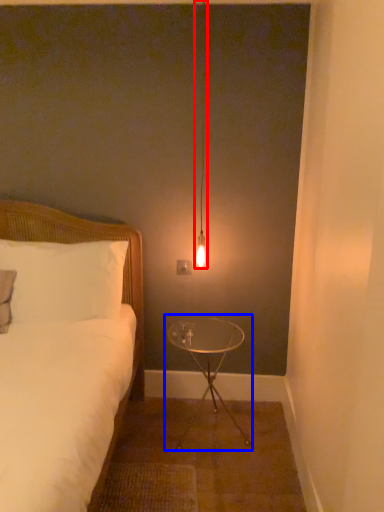
Question: Which of the following is the farthest to the observer, lamp (highlighted by a red box) or table (highlighted by a blue box)?

Choices:
 (A) lamp
 (B) table

Answer: (B)